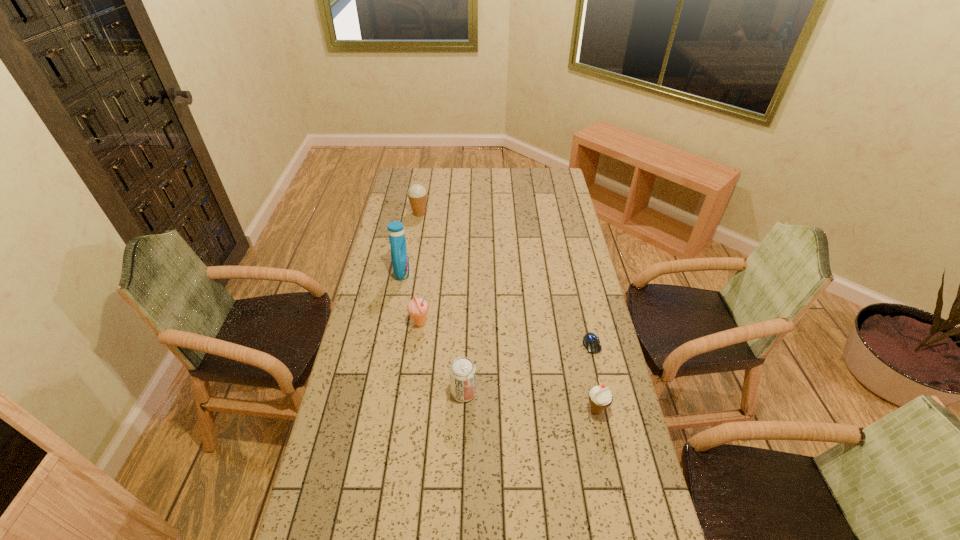
In order to click on the tallest object in this screenshot , I will do `click(399, 253)`.

The width and height of the screenshot is (960, 540). I want to click on detergent, so click(x=399, y=253).

Locate an element on the screen. the farthest object is located at coordinates (417, 194).

Locate an element on the screen. the second nearest icecream is located at coordinates (417, 308).

I want to click on soda can, so click(x=462, y=371).

Image resolution: width=960 pixels, height=540 pixels. I want to click on the rightmost icecream, so [600, 397].

Where is `the shortest object`? the shortest object is located at coordinates (591, 342).

You are a GUI agent. You are given a task and a screenshot of the screen. Output one action in this format:
    pyautogui.click(x=<x>, y=<y>)
    Task: Click on the third nearest object
    This screenshot has width=960, height=540.
    Given the screenshot: What is the action you would take?
    pyautogui.click(x=591, y=342)

This screenshot has height=540, width=960. Find the location of `free space located on the front-facing side of the tallest object`. free space located on the front-facing side of the tallest object is located at coordinates (436, 273).

The image size is (960, 540). Find the location of `free space located on the right of the farthest object`. free space located on the right of the farthest object is located at coordinates (495, 213).